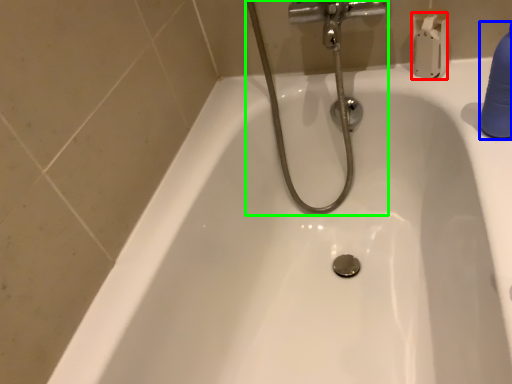
Question: Based on their relative distances, which object is nearer to toilet paper (highlighted by a red box)? Choose from cleaning product (highlighted by a blue box) and plumbing fixture (highlighted by a green box).

Choices:
 (A) cleaning product
 (B) plumbing fixture

Answer: (B)